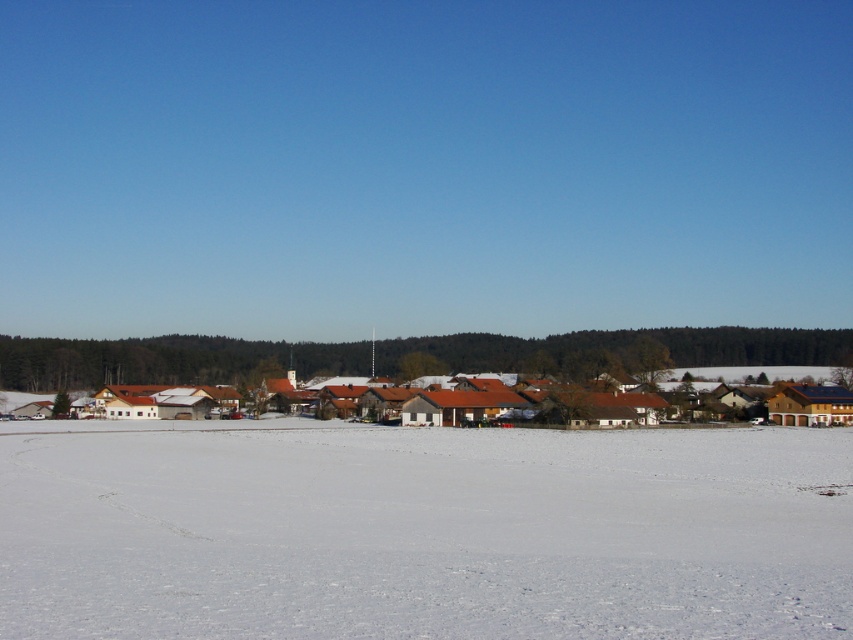
Question: Which of the following is the closest to the observer?

Choices:
 (A) (668, 372)
 (B) (45, 481)

Answer: (B)

Question: Can you confirm if white powdery snow at center is positioned above brown wooden houses at center?

Choices:
 (A) no
 (B) yes

Answer: (B)

Question: Can you confirm if white powdery snow at center is positioned above brown wooden houses at center?

Choices:
 (A) yes
 (B) no

Answer: (A)

Question: Which object is closer to the camera taking this photo?

Choices:
 (A) white powdery snow at center
 (B) brown wooden houses at center

Answer: (A)

Question: Which point appears closest to the camera in this image?

Choices:
 (A) (666, 380)
 (B) (357, 476)

Answer: (B)

Question: Can you confirm if white powdery snow at center is positioned to the left of brown wooden houses at center?

Choices:
 (A) yes
 (B) no

Answer: (B)